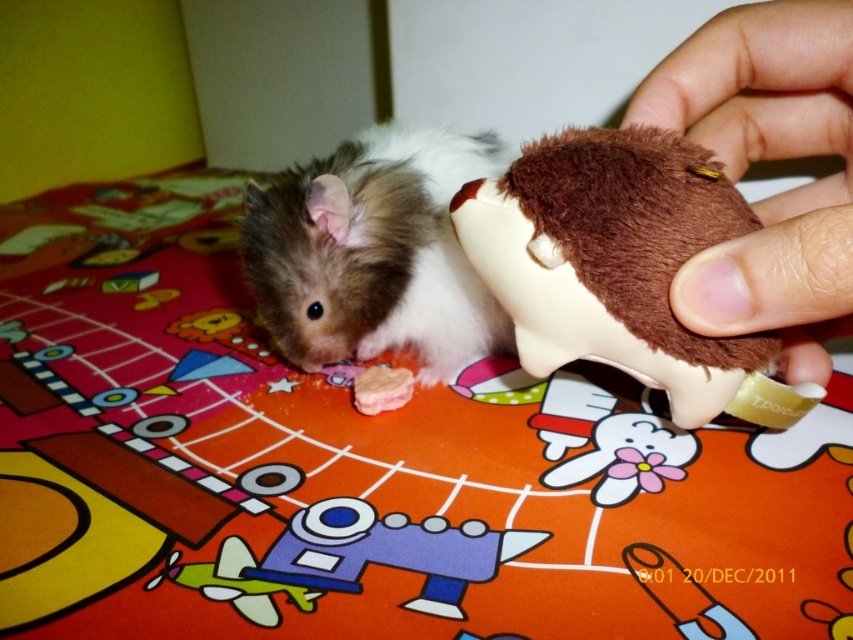
You are a child who wants to place both the brown plush toy at center and the brown fuzzy toy at upper right on a shelf. Which toy should you place first if you want the taller one to be at the back?

The brown fuzzy toy at upper right is taller than the brown plush toy at center, so you should place the brown fuzzy toy at upper right first at the back.

You are a photographer trying to capture the hamster and the plush toy in the image. You need to adjust your camera focus so that both the point at point (675,76) and point at point (350,253) are in sharp focus. Which point should you focus on first to ensure both are clear?

Point (675,76) is closer to the viewer than point (350,253). To ensure both points are in focus, you should focus on the closer point first, which is point (675,76).